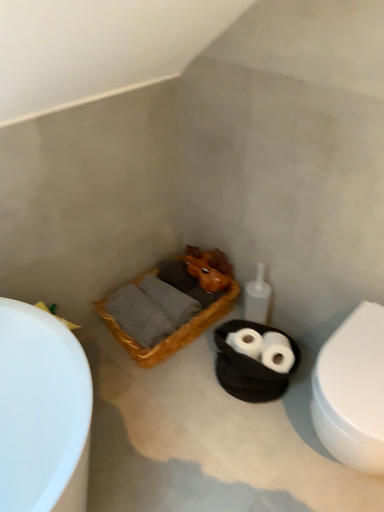
Find the location of a particular element. empty space that is in between white glossy bathtub at left and woven wood basket at center is located at coordinates (112, 367).